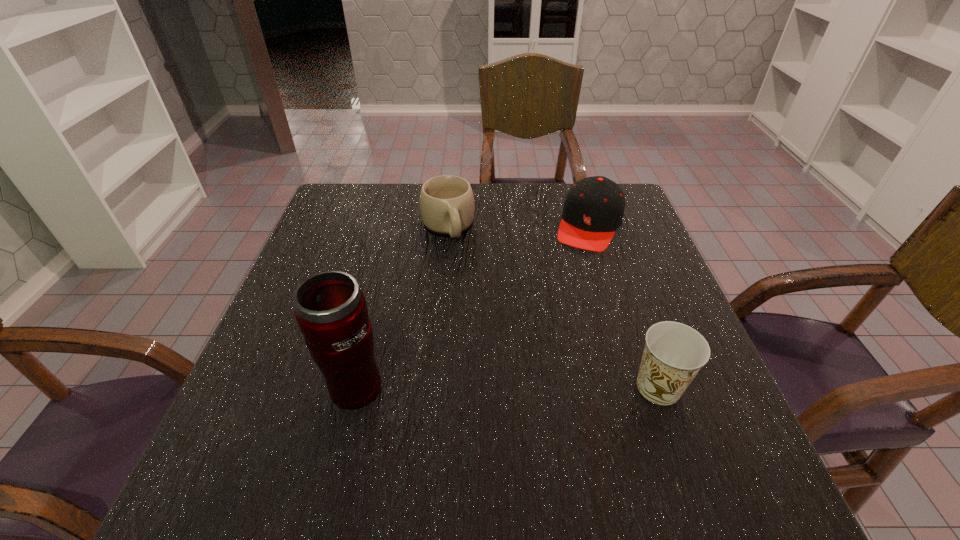
Identify the location of vacant area that lies between the cap and the second object from left to right. This screenshot has width=960, height=540. click(518, 226).

Image resolution: width=960 pixels, height=540 pixels. I want to click on free spot between the cap and the tallest object, so pyautogui.click(x=471, y=306).

Identify the location of free space between the cap and the mug. (518, 226).

Locate an element on the screen. This screenshot has width=960, height=540. vacant area that lies between the Dixie cup and the tallest object is located at coordinates (506, 386).

Image resolution: width=960 pixels, height=540 pixels. I want to click on free area in between the mug and the Dixie cup, so click(553, 307).

You are a GUI agent. You are given a task and a screenshot of the screen. Output one action in this format:
    pyautogui.click(x=<x>, y=<y>)
    Task: Click on the free spot between the Dixie cup and the cap
    The width and height of the screenshot is (960, 540).
    Given the screenshot: What is the action you would take?
    pyautogui.click(x=624, y=306)

The height and width of the screenshot is (540, 960). I want to click on vacant space in between the second object from left to right and the Dixie cup, so click(553, 307).

At what (x,y) coordinates should I click in order to perform the action: click on vacant point located between the cap and the mug. Please return your answer as a coordinate pair (x, y). Looking at the image, I should click on (518, 226).

Identify which object is the closest to the cap. Please provide its 2D coordinates. Your answer should be formatted as a tuple, i.e. [(x, y)], where the tuple contains the x and y coordinates of a point satisfying the conditions above.

[(447, 205)]

The image size is (960, 540). Identify the location of object identified as the second closest to the leftmost object. (674, 353).